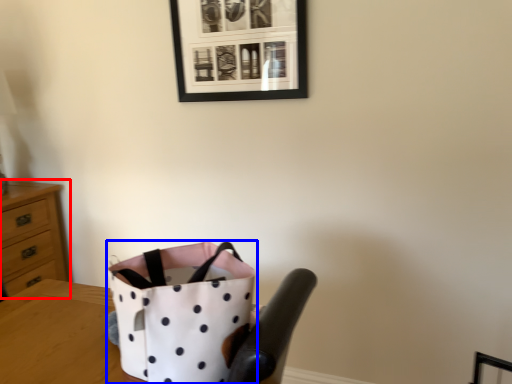
Question: Which point is further to the camera, chest of drawers (highlighted by a red box) or handbag (highlighted by a blue box)?

Choices:
 (A) chest of drawers
 (B) handbag

Answer: (A)